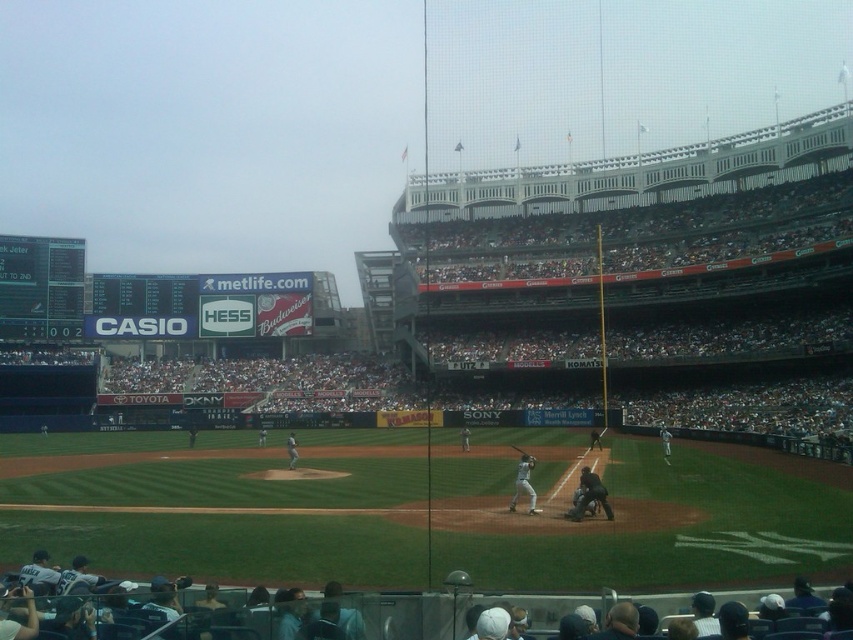
You are a photographer standing at the edge of the field. You want to take a photo that includes both the black leather umpire at center and the metallic silver bat at center. Which object should you focus on first if you want to ensure both are in the frame without moving the camera?

The black leather umpire at center is shorter than the metallic silver bat at center, so you should focus on the umpire first to ensure both are in the frame.

You are a spectator at the game and want to take a photo of the black leather umpire at center without including the black digital scoreboard at left in the frame. Is this possible given their positions?

The black digital scoreboard at left is further to the viewer than the black leather umpire at center, so the umpire is closer to you. By adjusting your camera angle to focus on the umpire while avoiding the scoreboard behind, it is possible to capture the umpire without the scoreboard in the frame.